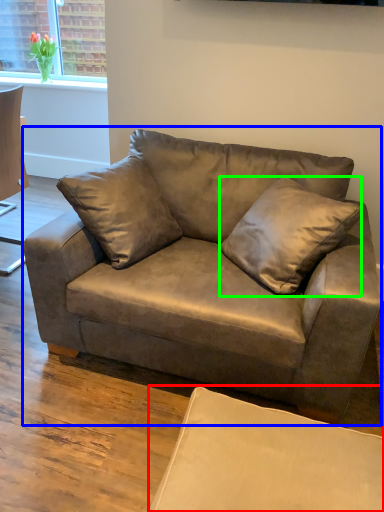
Question: Which is farther away from swivel chair (highlighted by a red box)? studio couch (highlighted by a blue box) or pillow (highlighted by a green box)?

Choices:
 (A) studio couch
 (B) pillow

Answer: (B)